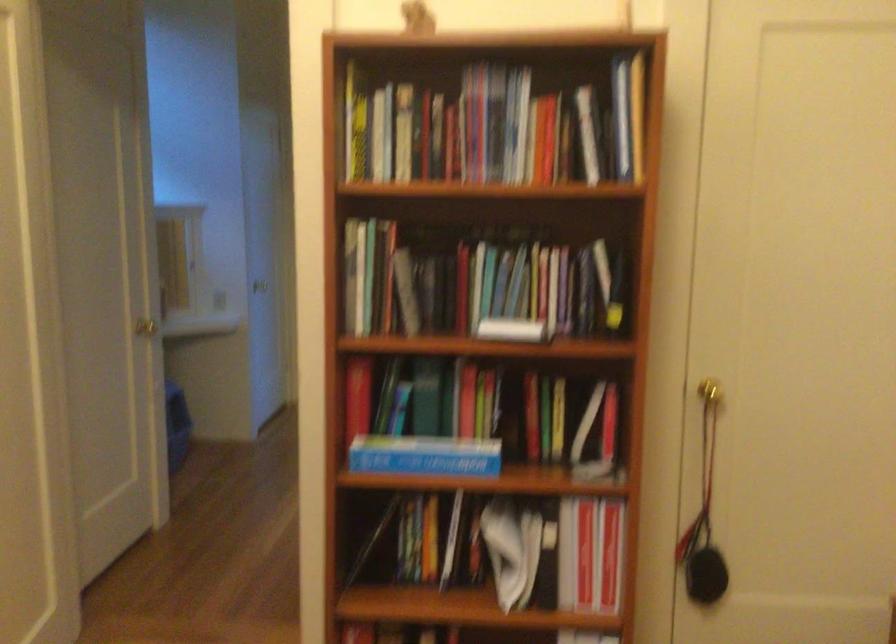
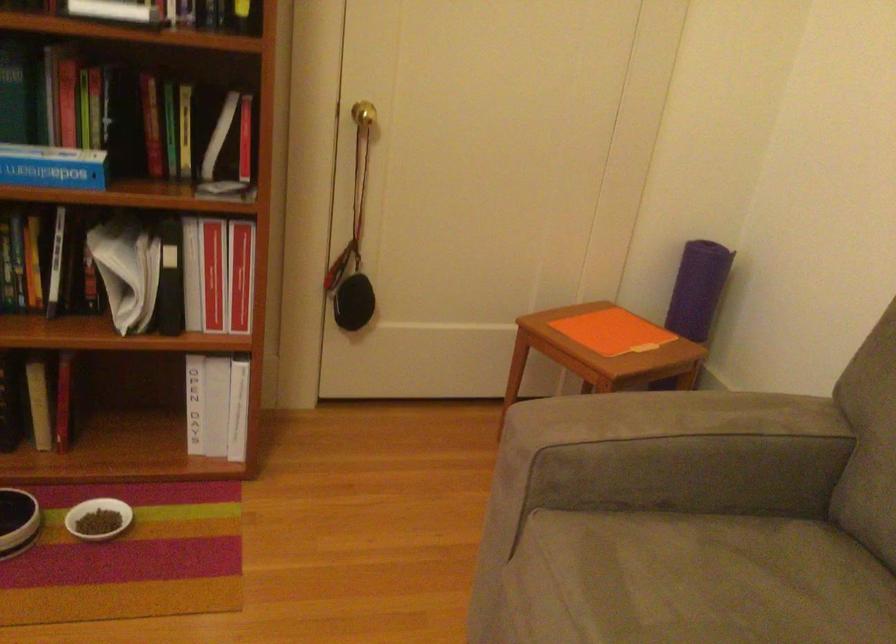
Locate, in the second image, the point that corresponds to the point at 583,550 in the first image.

(212, 274)